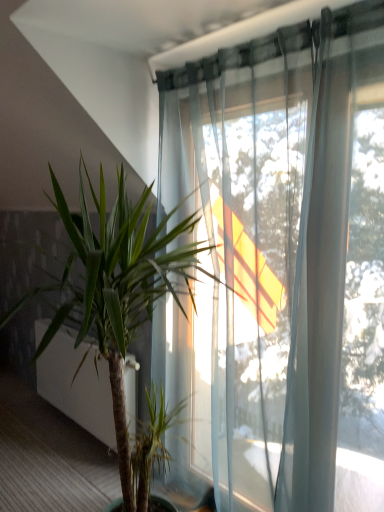
Where is `free space underneath green leafy plant at lower left (from a real-world perspective)`? The height and width of the screenshot is (512, 384). free space underneath green leafy plant at lower left (from a real-world perspective) is located at coordinates (x=86, y=433).